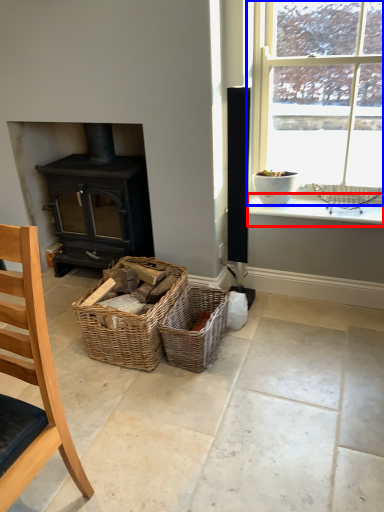
Question: Among these objects, which one is nearest to the camera, window sill (highlighted by a red box) or window (highlighted by a blue box)?

Choices:
 (A) window sill
 (B) window

Answer: (B)